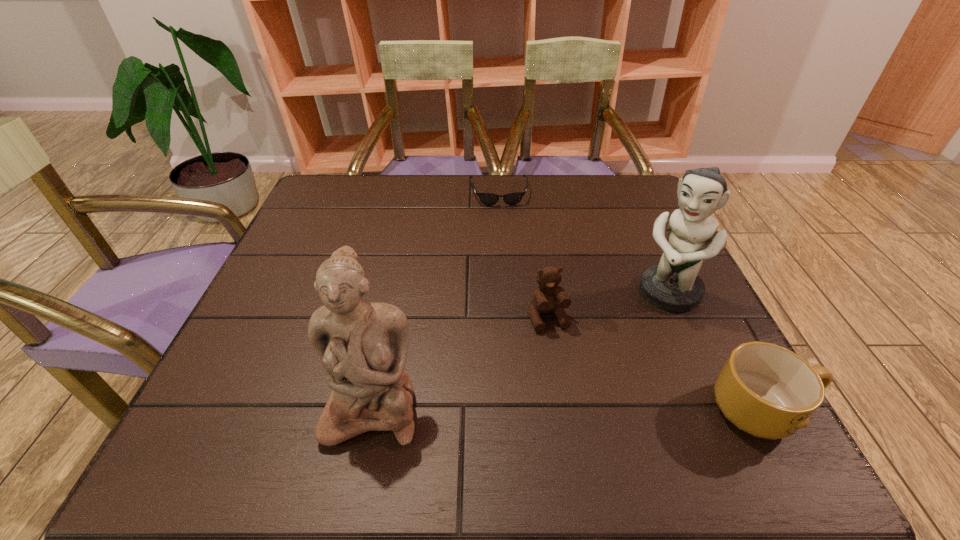
The image size is (960, 540). Identify the location of vacant region located on the face of the teddy bear. (564, 357).

Identify the location of vacant space situated on the face of the teddy bear. The image size is (960, 540). (564, 357).

You are a GUI agent. You are given a task and a screenshot of the screen. Output one action in this format:
    pyautogui.click(x=<x>, y=<y>)
    Task: Click on the vacant space located 0.170m on the face of the teddy bear
    
    Given the screenshot: What is the action you would take?
    pyautogui.click(x=583, y=408)

This screenshot has height=540, width=960. Find the location of `free spot located 0.200m on the front-facing side of the right figurine`. free spot located 0.200m on the front-facing side of the right figurine is located at coordinates (606, 368).

In order to click on free space located on the front-facing side of the right figurine in this screenshot , I will do `click(577, 403)`.

Locate an element on the screen. The image size is (960, 540). blank space located on the front-facing side of the right figurine is located at coordinates (621, 348).

You are a GUI agent. You are given a task and a screenshot of the screen. Output one action in this format:
    pyautogui.click(x=<x>, y=<y>)
    Task: Click on the object present at the far edge
    This screenshot has height=540, width=960.
    Given the screenshot: What is the action you would take?
    pyautogui.click(x=489, y=199)

Where is `figurine located at the near edge`? figurine located at the near edge is located at coordinates (363, 346).

This screenshot has height=540, width=960. What are the coordinates of `mug positioned at the near edge` in the screenshot? It's located at (768, 391).

The height and width of the screenshot is (540, 960). I want to click on mug situated at the right edge, so click(768, 391).